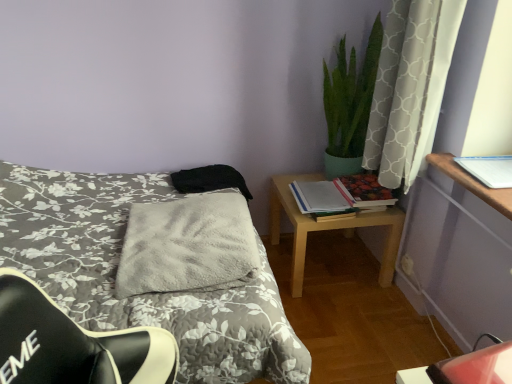
Question: Is hardcover book at right, positioned as the second book in left-to-right order, in contact with gray fluffy blanket at center?

Choices:
 (A) no
 (B) yes

Answer: (A)

Question: Is hardcover book at right, positioned as the second book in left-to-right order, at the left side of gray fluffy blanket at center?

Choices:
 (A) yes
 (B) no

Answer: (B)

Question: From the image's perspective, would you say hardcover book at right, positioned as the second book in left-to-right order, is shown under gray fluffy blanket at center?

Choices:
 (A) no
 (B) yes

Answer: (A)

Question: Would you say gray fluffy blanket at center is part of hardcover book at right, positioned as the second book in left-to-right order,'s contents?

Choices:
 (A) yes
 (B) no

Answer: (B)

Question: Are hardcover book at right, which appears as the second book when viewed from the right, and gray fluffy blanket at center located far from each other?

Choices:
 (A) no
 (B) yes

Answer: (A)

Question: Is black fabric pillow at center in front of or behind gray fluffy blanket at center in the image?

Choices:
 (A) behind
 (B) front

Answer: (A)

Question: Is black fabric pillow at center wider or thinner than gray fluffy blanket at center?

Choices:
 (A) wide
 (B) thin

Answer: (B)

Question: From the image's perspective, relative to gray fluffy blanket at center, is black fabric pillow at center above or below?

Choices:
 (A) above
 (B) below

Answer: (A)

Question: Would you say black fabric pillow at center is inside or outside gray fluffy blanket at center?

Choices:
 (A) inside
 (B) outside

Answer: (B)

Question: Considering the positions of black fabric pillow at center and light wood/texture nightstand at right in the image, is black fabric pillow at center bigger or smaller than light wood/texture nightstand at right?

Choices:
 (A) big
 (B) small

Answer: (B)

Question: Considering their positions, is black fabric pillow at center located in front of or behind light wood/texture nightstand at right?

Choices:
 (A) front
 (B) behind

Answer: (B)

Question: Does point (216, 182) appear closer or farther from the camera than point (302, 246)?

Choices:
 (A) farther
 (B) closer

Answer: (A)

Question: In terms of height, does black fabric pillow at center look taller or shorter compared to light wood/texture nightstand at right?

Choices:
 (A) tall
 (B) short

Answer: (B)

Question: From a real-world perspective, is matte paper book at center right, positioned as the 3th book in right-to-left order, above or below gray fluffy blanket at center?

Choices:
 (A) above
 (B) below

Answer: (B)

Question: From the image's perspective, is matte paper book at center right, the second book from the front, located above or below gray fluffy blanket at center?

Choices:
 (A) above
 (B) below

Answer: (A)